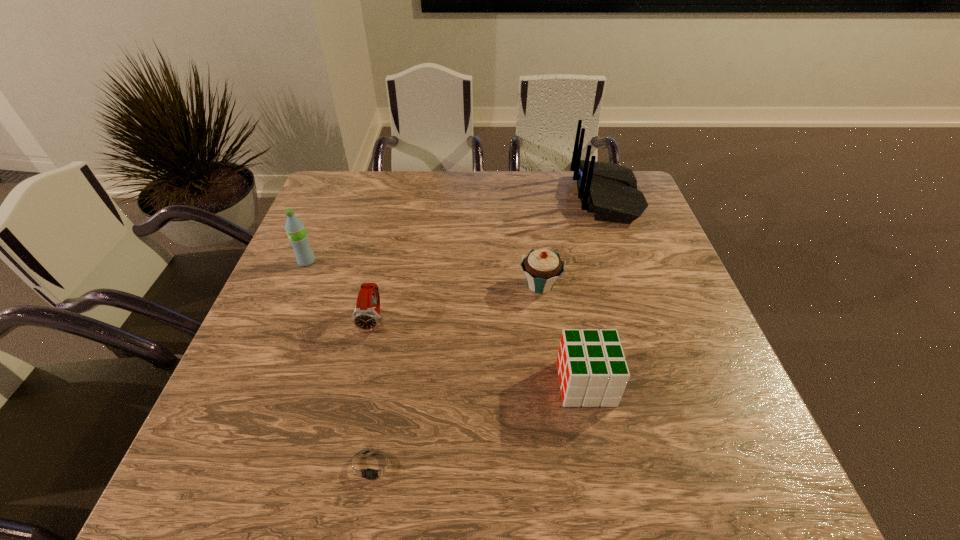
Identify the location of object at the near edge. (373, 467).

In order to click on object present at the left edge in this screenshot , I will do `click(295, 229)`.

Where is `object at the right edge`? Image resolution: width=960 pixels, height=540 pixels. object at the right edge is located at coordinates (608, 190).

You are a GUI agent. You are given a task and a screenshot of the screen. Output one action in this format:
    pyautogui.click(x=<x>, y=<y>)
    Task: Click on the object that is at the far right corner
    
    Given the screenshot: What is the action you would take?
    pyautogui.click(x=608, y=190)

Where is `vacant position at the far edge of the desktop`? The height and width of the screenshot is (540, 960). vacant position at the far edge of the desktop is located at coordinates (377, 193).

Where is `free space at the near edge`? The height and width of the screenshot is (540, 960). free space at the near edge is located at coordinates (467, 464).

The width and height of the screenshot is (960, 540). I want to click on vacant space at the left edge, so click(309, 334).

The height and width of the screenshot is (540, 960). What are the coordinates of `vacant space at the right edge of the desktop` in the screenshot? It's located at 672,334.

What are the coordinates of `vacant space at the far left corner of the desktop` in the screenshot? It's located at (372, 183).

The width and height of the screenshot is (960, 540). Identify the location of vacant space at the near left corner. (232, 460).